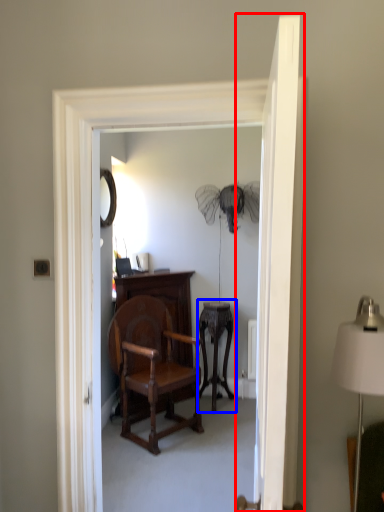
Question: Which of the following is the farthest to the observer, door (highlighted by a red box) or side table (highlighted by a blue box)?

Choices:
 (A) door
 (B) side table

Answer: (B)